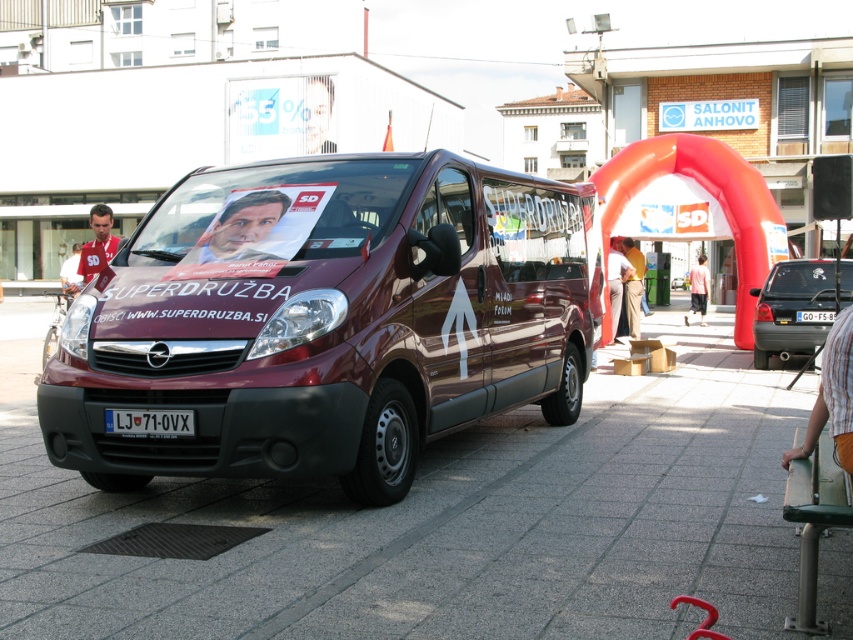
Is maroon metallic van at center smaller than matte red shirt at center?

Yes, maroon metallic van at center is smaller than matte red shirt at center.

Which is behind, point (575, 237) or point (73, 296)?

The point (73, 296) is more distant.

The image size is (853, 640). What are the coordinates of `maroon metallic van at center` in the screenshot? It's located at click(323, 324).

You are a GUI agent. You are given a task and a screenshot of the screen. Output one action in this format:
    pyautogui.click(x=<x>, y=<y>)
    Task: Click on the matte black shirt at left
    The width and height of the screenshot is (853, 640).
    Given the screenshot: What is the action you would take?
    pyautogui.click(x=97, y=243)

Between point (103, 221) and point (68, 264), which one is positioned behind?

The point (68, 264) is behind.

Locate an element on the screen. The height and width of the screenshot is (640, 853). matte black shirt at left is located at coordinates (97, 243).

Consider the image. Which is more to the left, smooth plastic poster at center or light brown fabric pants at center?

From the viewer's perspective, smooth plastic poster at center appears more on the left side.

Can you confirm if smooth plastic poster at center is thinner than light brown fabric pants at center?

No.

Between point (230, 240) and point (612, 291), which one is positioned behind?

Positioned behind is point (612, 291).

I want to click on smooth plastic poster at center, so click(241, 227).